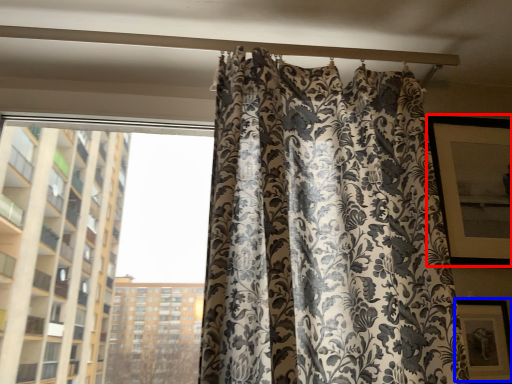
Question: Among these objects, which one is farthest to the camera, window screen (highlighted by a red box) or picture frame (highlighted by a blue box)?

Choices:
 (A) window screen
 (B) picture frame

Answer: (A)